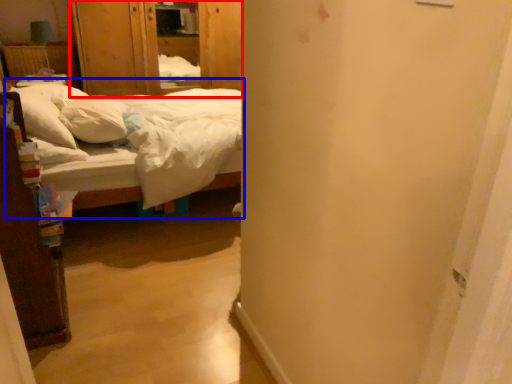
Question: Which point is further to the camera, armoire (highlighted by a red box) or bed (highlighted by a blue box)?

Choices:
 (A) armoire
 (B) bed

Answer: (A)